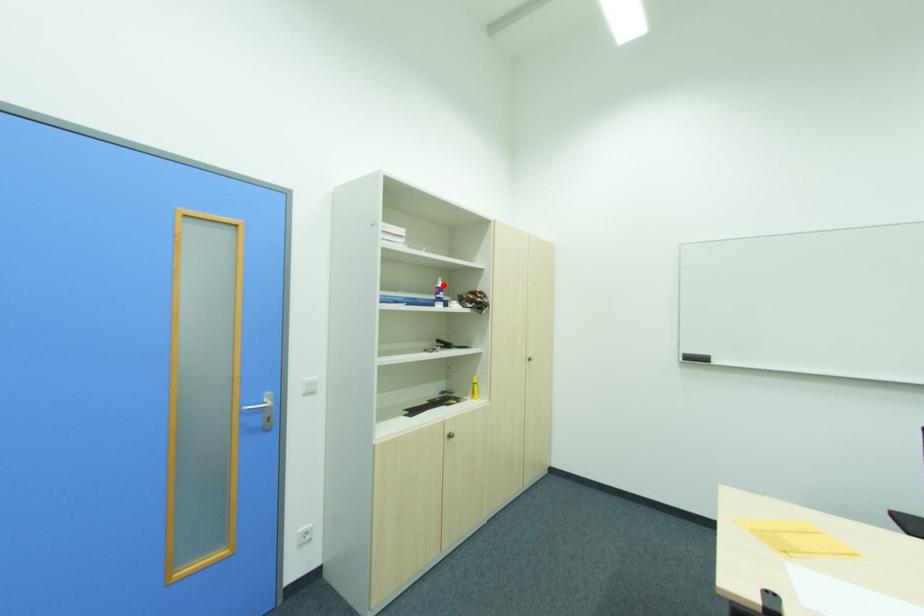
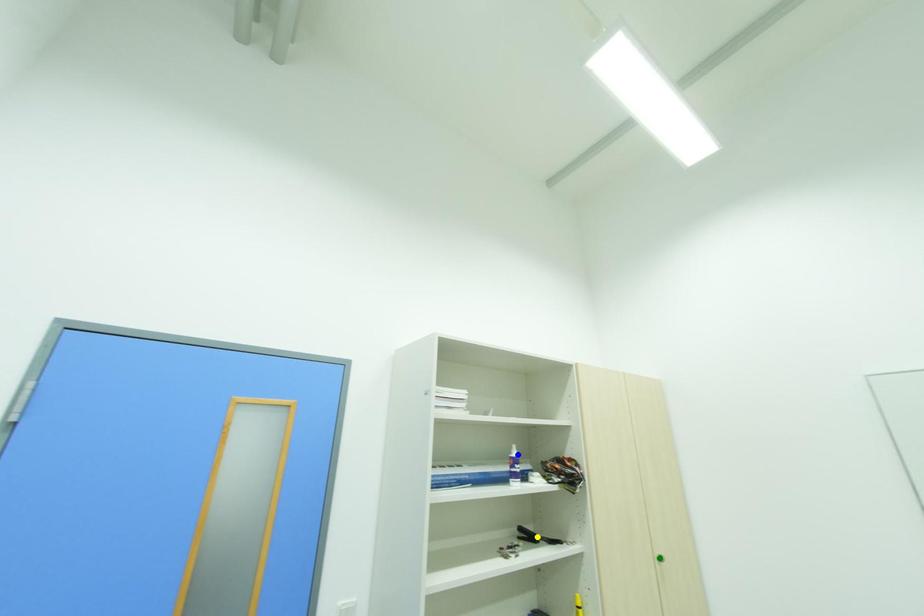
Question: I am providing you with two images of the same scene from different viewpoints. A red point is marked on the first image. You are given multiple points on the second image. Which point in image 2 is actually the same real-world point as the red point in image 1?

Choices:
 (A) blue point
 (B) green point
 (C) yellow point

Answer: (A)